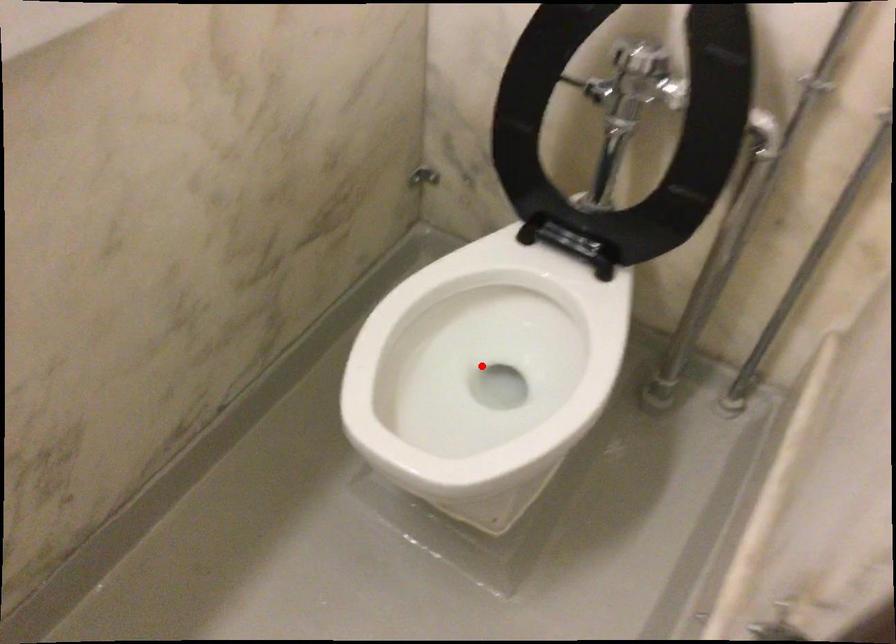
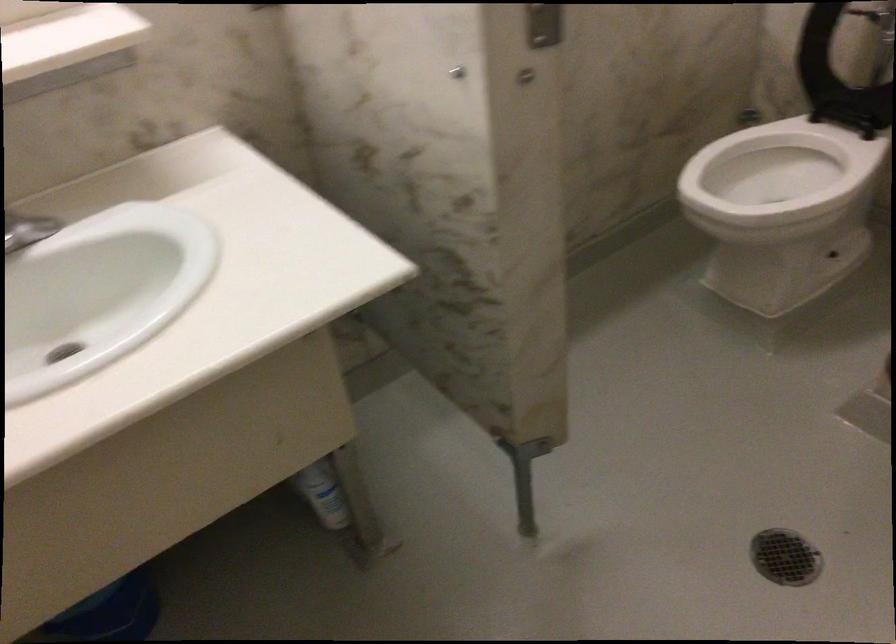
Question: I am providing you with two images of the same scene from different viewpoints. A red point is marked on the first image. Is the red point's position out of view in image 2?

Choices:
 (A) Yes
 (B) No

Answer: (A)